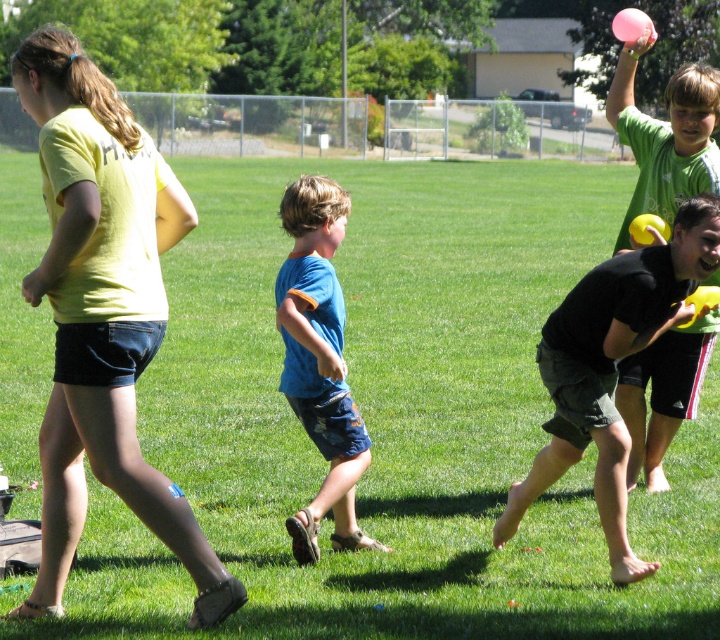
Does yellow matte shirt at left lie in front of black matte shorts at right?

Yes, it is.

Does yellow matte shirt at left appear over black matte shorts at right?

Correct, yellow matte shirt at left is located above black matte shorts at right.

Where is `yellow matte shirt at left`? yellow matte shirt at left is located at coordinates (103, 314).

This screenshot has width=720, height=640. Describe the element at coordinates (103, 314) in the screenshot. I see `yellow matte shirt at left` at that location.

Can you confirm if yellow matte shirt at left is bigger than blue cotton shorts at center?

Yes, yellow matte shirt at left is bigger than blue cotton shorts at center.

Who is more forward, (102, 387) or (318, 381)?

Point (102, 387) is more forward.

Find the location of a particular element. This screenshot has width=720, height=640. yellow matte shirt at left is located at coordinates (103, 314).

Is yellow matte shirt at left bigger than pink rubber ball at upper right?

Actually, yellow matte shirt at left might be smaller than pink rubber ball at upper right.

Which is behind, point (76, 499) or point (643, 410)?

Point (643, 410)

At what (x,y) coordinates should I click in order to perform the action: click on yellow matte shirt at left. Please return your answer as a coordinate pair (x, y). The width and height of the screenshot is (720, 640). Looking at the image, I should click on (103, 314).